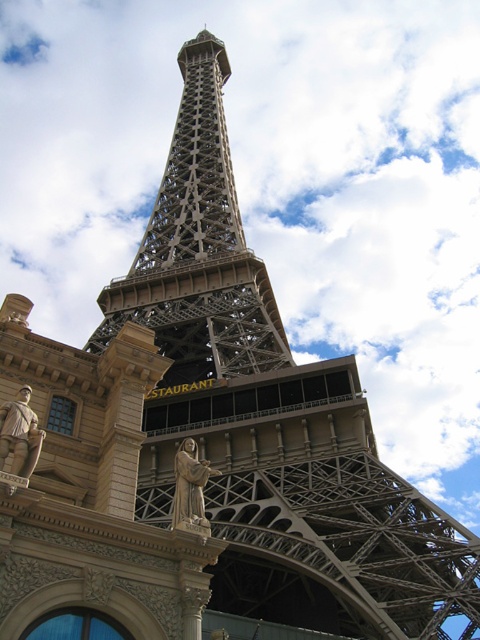
Question: Which of the following is the closest to the observer?

Choices:
 (A) polished bronze statue at lower left
 (B) metallic gray eiffel tower at center

Answer: (A)

Question: Is the position of polished bronze statue at lower left more distant than that of stone statue at center?

Choices:
 (A) no
 (B) yes

Answer: (A)

Question: Estimate the real-world distances between objects in this image. Which object is closer to the stone statue at center?

Choices:
 (A) metallic gray eiffel tower at center
 (B) polished bronze statue at lower left

Answer: (B)

Question: Does metallic gray eiffel tower at center lie in front of stone statue at center?

Choices:
 (A) yes
 (B) no

Answer: (B)

Question: Which of the following is the closest to the observer?

Choices:
 (A) stone statue at center
 (B) polished bronze statue at lower left
 (C) metallic gray eiffel tower at center

Answer: (B)

Question: Does polished bronze statue at lower left lie in front of stone statue at center?

Choices:
 (A) yes
 (B) no

Answer: (A)